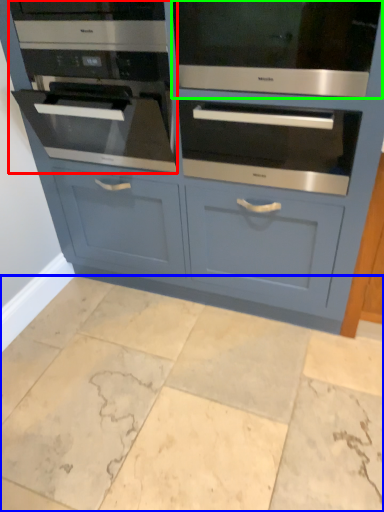
Question: Based on their relative distances, which object is nearer to oven (highlighted by a red box)? Choose from ceramic tile (highlighted by a blue box) and oven (highlighted by a green box).

Choices:
 (A) ceramic tile
 (B) oven

Answer: (B)